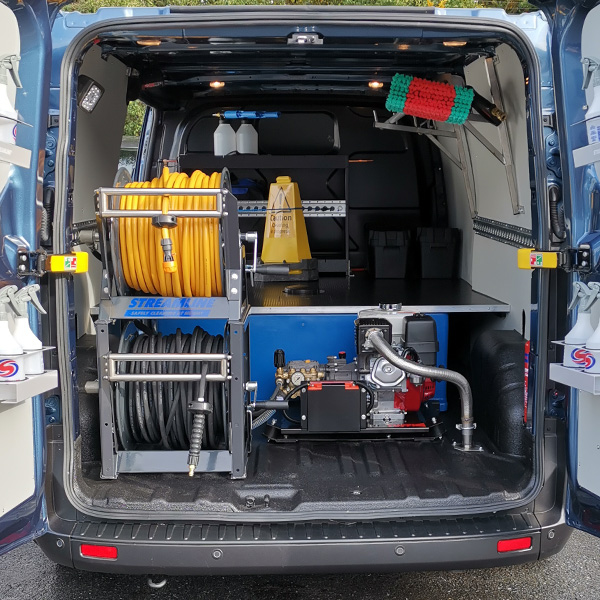
What are the coordinates of `spray bottles on inside of right door` in the screenshot? It's located at (578, 339), (594, 346).